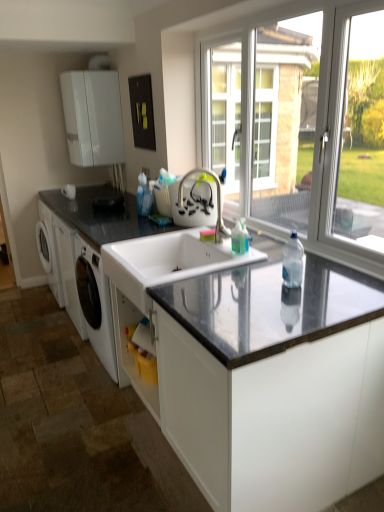
Where is `free space in front of clear plastic bottle at center`? This screenshot has height=512, width=384. free space in front of clear plastic bottle at center is located at coordinates (296, 290).